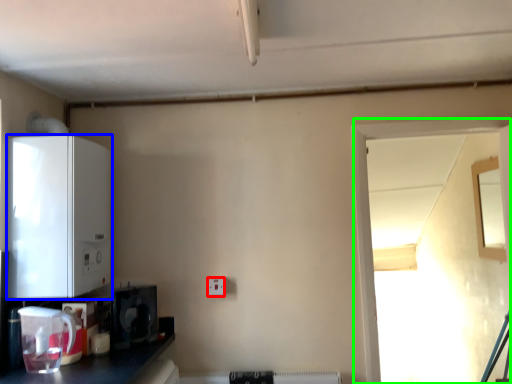
Question: Based on their relative distances, which object is farther from electric outlet (highlighted by a red box)? Choose from appliance (highlighted by a blue box) and window (highlighted by a green box).

Choices:
 (A) appliance
 (B) window

Answer: (B)